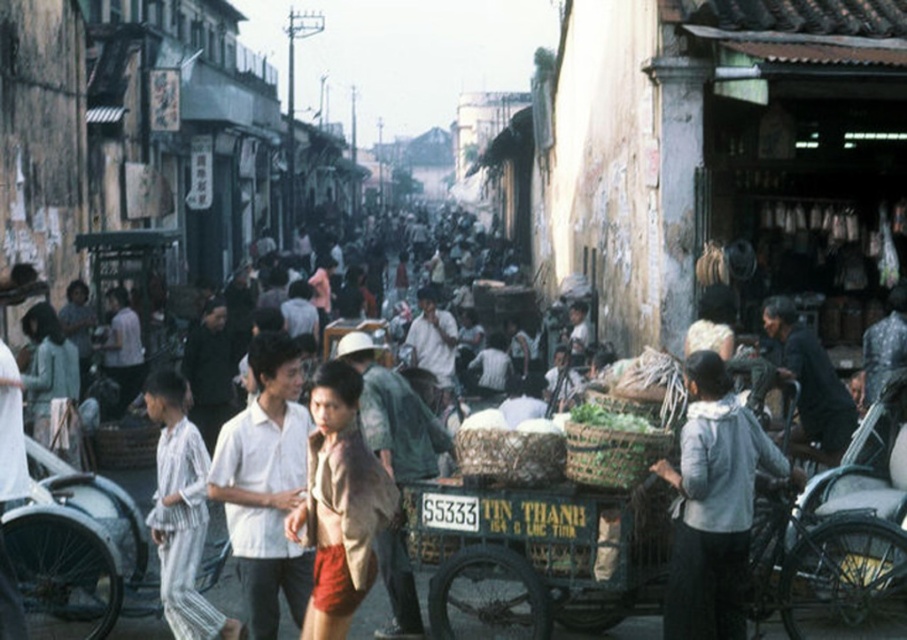
Question: Which point is closer to the camera?

Choices:
 (A) light brown fabric shirt at center
 (B) dark green fabric shirt at center
 (C) green painted wood cart at center
 (D) white matte shirt at center

Answer: (D)

Question: Is light gray fabric at lower right to the right of white matte shirt at center from the viewer's perspective?

Choices:
 (A) yes
 (B) no

Answer: (A)

Question: Does light gray fabric at lower right appear over light brown fabric shirt at center?

Choices:
 (A) yes
 (B) no

Answer: (B)

Question: Which object appears closest to the camera in this image?

Choices:
 (A) light brown fabric shirt at center
 (B) green painted wood cart at center
 (C) white matte shirt at center
 (D) dark green fabric shirt at center

Answer: (C)

Question: Is light brown fabric shirt at center to the left of dark green fabric shirt at center from the viewer's perspective?

Choices:
 (A) no
 (B) yes

Answer: (B)

Question: Which object appears closest to the camera in this image?

Choices:
 (A) light gray fabric at lower right
 (B) light brown fabric shirt at center

Answer: (A)